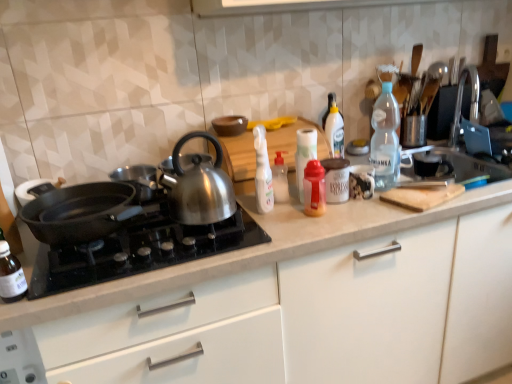
Question: From a real-world perspective, relative to translucent plastic bottle at center, which is counted as the fifth bottle, starting from the left, is white plastic spray bottle at center, which appears as the 2th bottle when viewed from the left, vertically above or below?

Choices:
 (A) below
 (B) above

Answer: (B)

Question: Based on their sizes in the image, would you say white plastic spray bottle at center, the fifth bottle when ordered from right to left, is bigger or smaller than translucent plastic bottle at center, the second bottle in the right-to-left sequence?

Choices:
 (A) small
 (B) big

Answer: (B)

Question: Which is nearer to the white plastic bottle at center, which is the 4th bottle from right to left?

Choices:
 (A) shiny metallic kettle at center
 (B) black non-stick pan at left
 (C) translucent plastic bottle at center, which is counted as the fifth bottle, starting from the left
 (D) transparent plastic bottle at center-right, which is the 6th bottle from left to right
 (E) white matte jar at center

Answer: (C)

Question: Which is nearer to the transparent plastic bottle at lower left, arranged as the 1th bottle when viewed from the left?

Choices:
 (A) white glossy paper towel at center, placed as the third bottle when sorted from right to left
 (B) transparent plastic bottle at center-right, which is the 6th bottle from left to right
 (C) white plastic spray bottle at center, which appears as the 2th bottle when viewed from the left
 (D) white matte jar at center
 (E) shiny metallic kettle at center

Answer: (E)